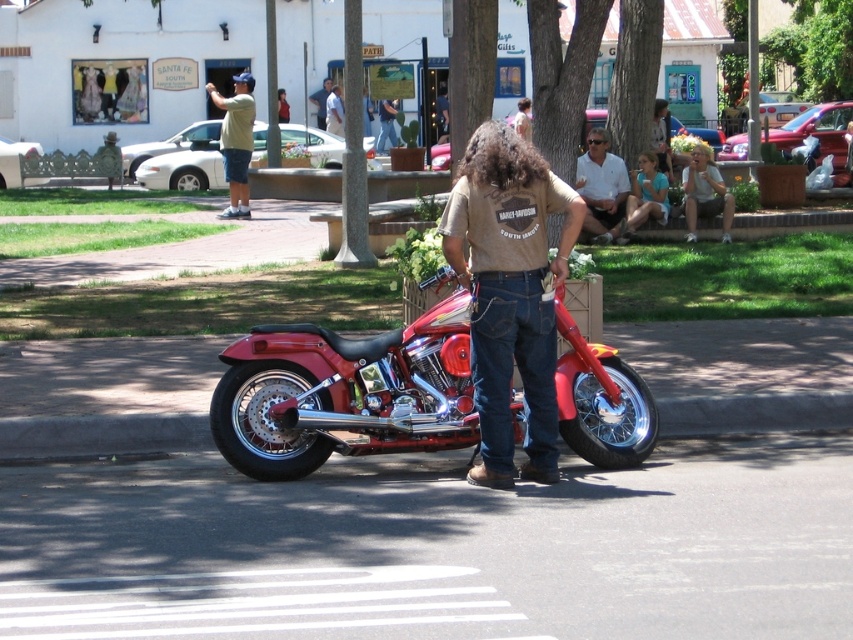
Question: Which of the following is the closest to the observer?

Choices:
 (A) (631, 173)
 (B) (254, 104)
 (C) (541, 337)

Answer: (C)

Question: Which of the following is the closest to the observer?

Choices:
 (A) (316, 116)
 (B) (296, 401)
 (C) (647, 156)
 (D) (705, 196)

Answer: (B)

Question: Can you confirm if white cotton polo shirt at center is wider than matte green t-shirt at upper center?

Choices:
 (A) yes
 (B) no

Answer: (B)

Question: Which point is farther to the camera?

Choices:
 (A) shiny red motorcycle at center
 (B) white cotton polo shirt at center
 (C) matte green t-shirt at upper center

Answer: (C)

Question: In this image, where is shiny red motorcycle at center located relative to white cotton polo shirt at center?

Choices:
 (A) above
 (B) below

Answer: (B)

Question: Is denim jeans at center to the right of matte green t-shirt at upper center from the viewer's perspective?

Choices:
 (A) no
 (B) yes

Answer: (B)